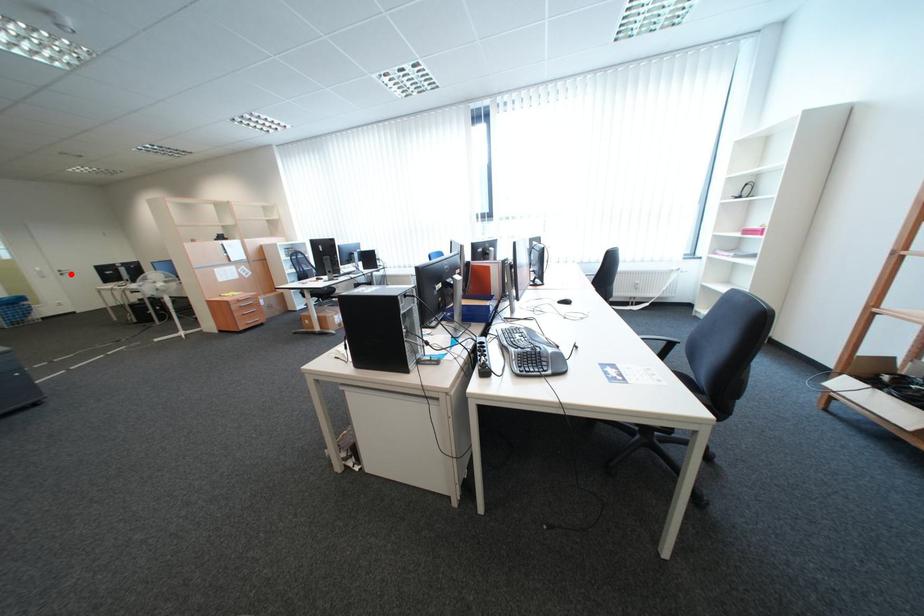
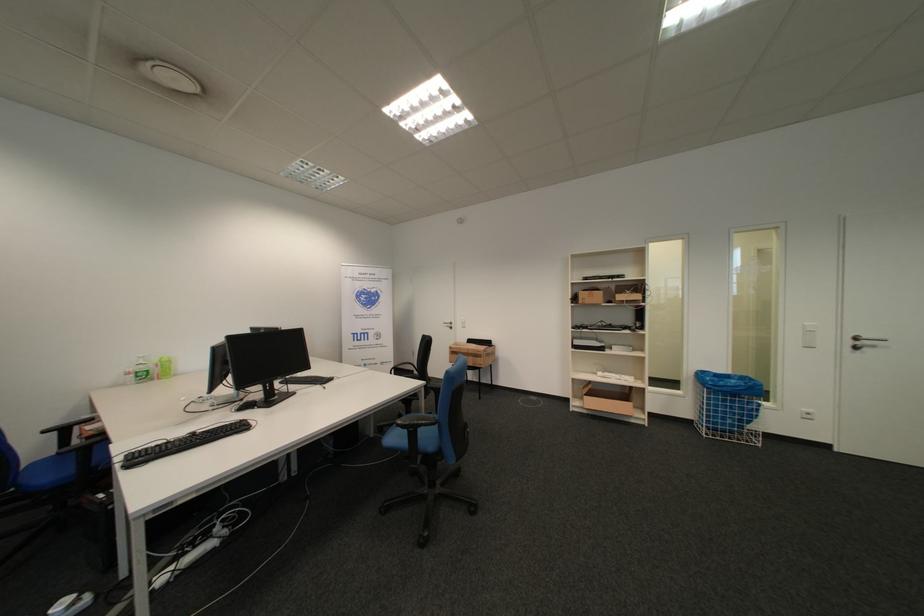
Question: I am providing you with two images of the same scene from different viewpoints. A red point is marked on the first image. At the location where the point appears in image 1, is it still visible in image 2?

Choices:
 (A) Yes
 (B) No

Answer: (A)